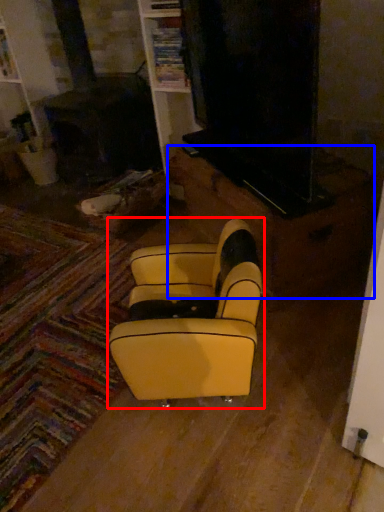
Question: Which object appears farthest to the camera in this image, rocking chair (highlighted by a red box) or furniture (highlighted by a blue box)?

Choices:
 (A) rocking chair
 (B) furniture

Answer: (B)